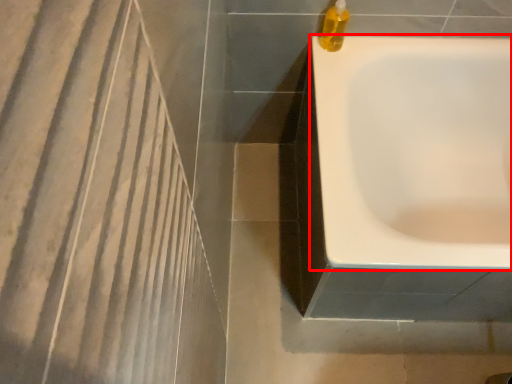
Question: From the image's perspective, where is bathtub (annotated by the red box) located relative to liquid?

Choices:
 (A) above
 (B) below

Answer: (B)